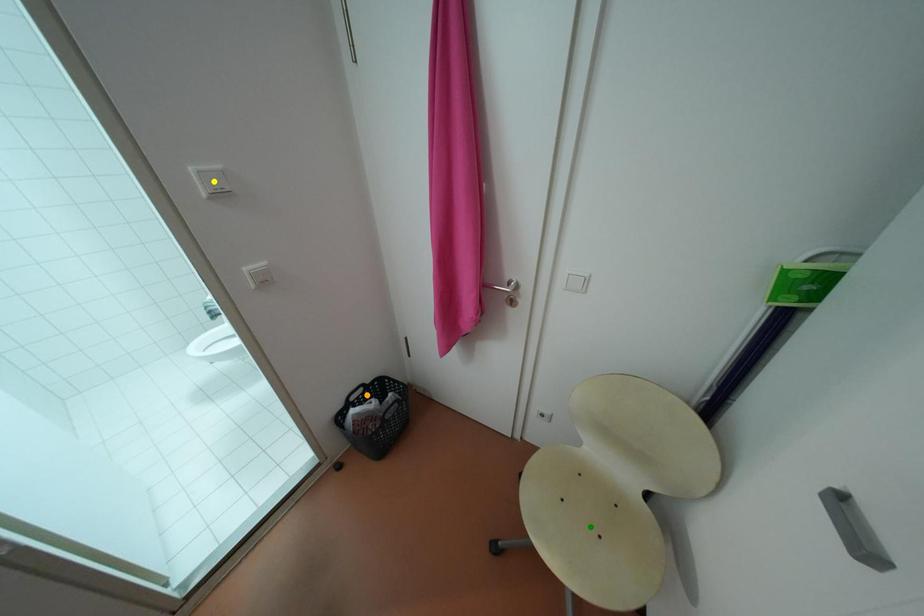
Based on the photo, order these from nearest to farthest:
1. green point
2. orange point
3. yellow point

yellow point, green point, orange point